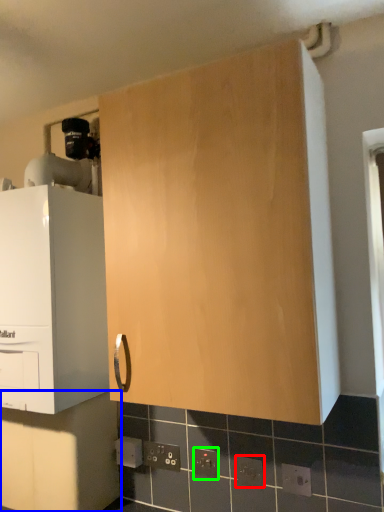
Question: Estimate the real-world distances between objects in this image. Which object is closer to electric outlet (highlighted by a red box), cabinetry (highlighted by a blue box) or electric outlet (highlighted by a green box)?

Choices:
 (A) cabinetry
 (B) electric outlet

Answer: (B)